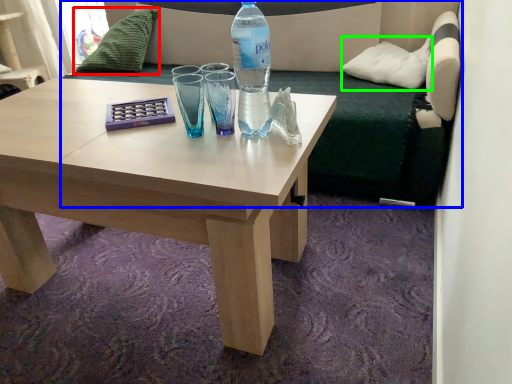
Question: Estimate the real-world distances between objects in this image. Which object is closer to pillow (highlighted by a red box), studio couch (highlighted by a blue box) or pillow (highlighted by a green box)?

Choices:
 (A) studio couch
 (B) pillow

Answer: (A)